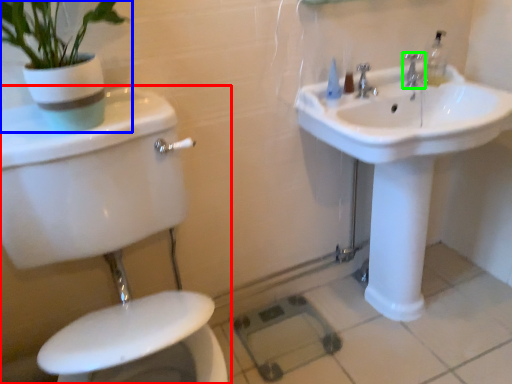
Question: Considering the real-world distances, which object is closest to toilet (highlighted by a red box)? houseplant (highlighted by a blue box) or tap (highlighted by a green box).

Choices:
 (A) houseplant
 (B) tap

Answer: (A)